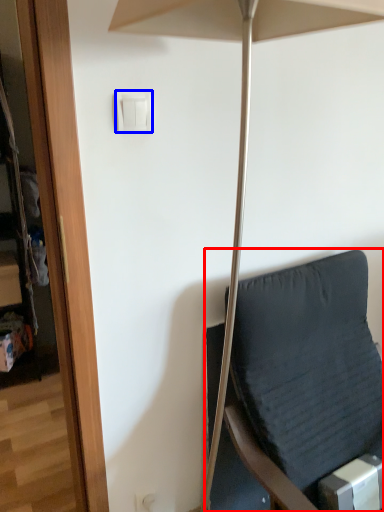
Question: Among these objects, which one is farthest to the camera, furniture (highlighted by a red box) or light switch (highlighted by a blue box)?

Choices:
 (A) furniture
 (B) light switch

Answer: (B)